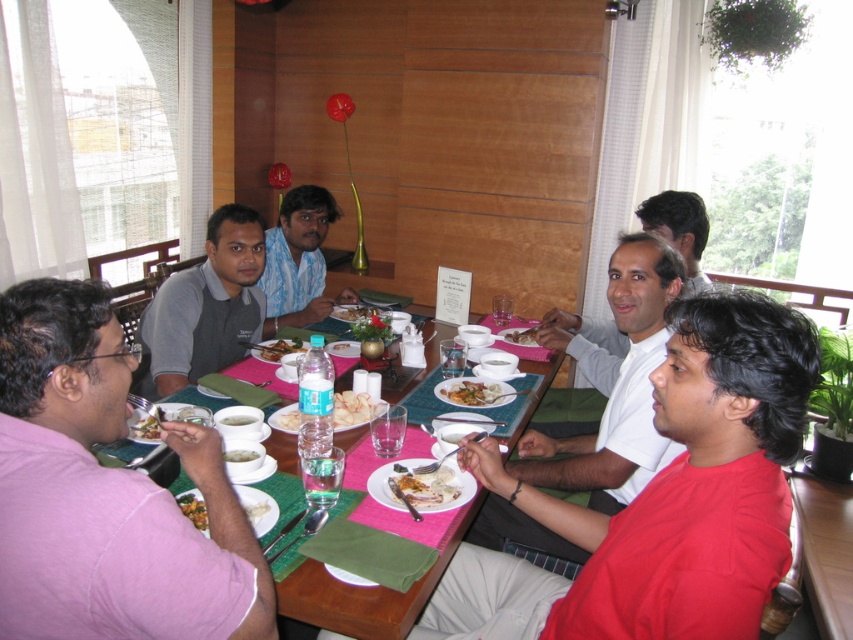
You are a server at the restaurant and need to deliver a plate to the table. The plate is 12 inches in diameter. Can you place it on the pink fabric table at center without it touching the white creamy rice at center?

The pink fabric table at center is much taller than the white creamy rice at center, so placing a 12 inch plate on the table would not interfere with the rice.

You are sitting at the dining table and notice a pink cotton shirt at left. Can you determine its exact position using the coordinate system provided?

The pink cotton shirt at left is located at point (106,493).